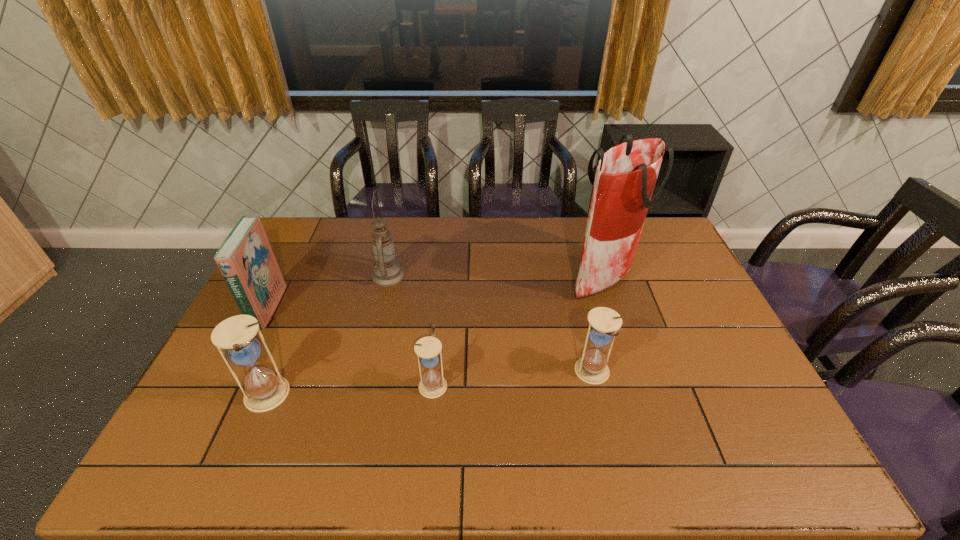
Locate which object ranks in proximity to the oil lamp. Please provide its 2D coordinates. Your answer should be formatted as a tuple, i.e. [(x, y)], where the tuple contains the x and y coordinates of a point satisfying the conditions above.

[(246, 260)]

Locate which object ranks third in proximity to the second hourglass from right to left. Please provide its 2D coordinates. Your answer should be formatted as a tuple, i.e. [(x, y)], where the tuple contains the x and y coordinates of a point satisfying the conditions above.

[(592, 368)]

Find the location of a particular element. hourglass that is the third closest to the hardback book is located at coordinates (592, 368).

I want to click on the second closest hourglass to the fifth object from right to left, so click(x=592, y=368).

Locate an element on the screen. The width and height of the screenshot is (960, 540). vacant space that satisfies the following two spatial constraints: 1. on the front side of the oil lamp; 2. on the left side of the fourth object from left to right is located at coordinates (363, 384).

Locate an element on the screen. This screenshot has height=540, width=960. vacant region that satisfies the following two spatial constraints: 1. on the front side of the oil lamp; 2. on the right side of the tallest object is located at coordinates (388, 278).

Find the location of a particular element. This screenshot has width=960, height=540. blank space that satisfies the following two spatial constraints: 1. on the back side of the fifth tallest object; 2. on the right side of the grocery bag is located at coordinates (570, 278).

Image resolution: width=960 pixels, height=540 pixels. Find the location of `free space that satisfies the following two spatial constraints: 1. on the front side of the second tallest hourglass; 2. on the left side of the fourth object from right to left`. free space that satisfies the following two spatial constraints: 1. on the front side of the second tallest hourglass; 2. on the left side of the fourth object from right to left is located at coordinates (365, 373).